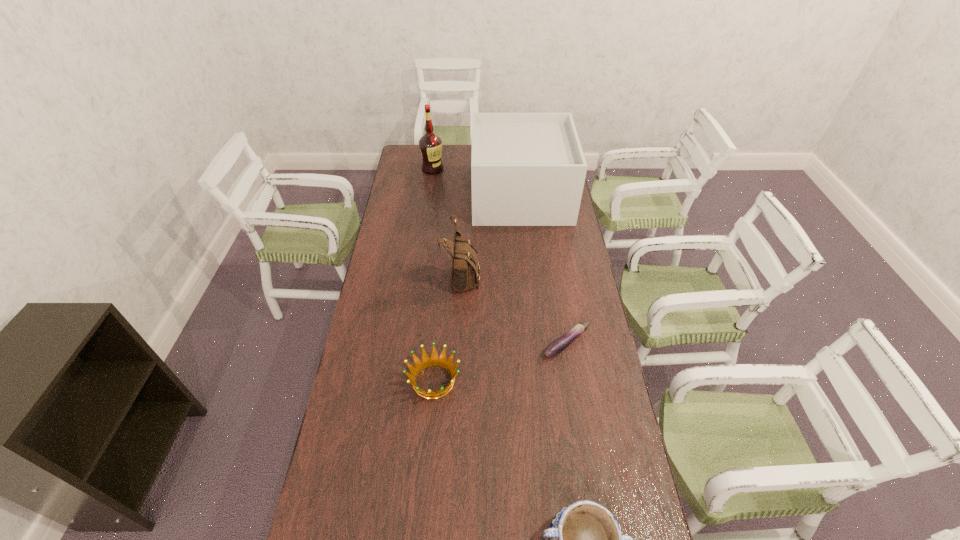
Identify the location of alcohol. (430, 144).

Image resolution: width=960 pixels, height=540 pixels. What are the coordinates of `box` in the screenshot? It's located at (527, 169).

You are a GUI agent. You are given a task and a screenshot of the screen. Output one action in this format:
    pyautogui.click(x=<x>, y=<y>)
    Task: Click on the fourth nearest object
    This screenshot has height=540, width=960.
    Given the screenshot: What is the action you would take?
    (464, 273)

I want to click on crown, so click(x=434, y=360).

Where is `eggplant`? The width and height of the screenshot is (960, 540). eggplant is located at coordinates (557, 346).

Where is `vacant region located on the label of the alcohol`? This screenshot has width=960, height=540. vacant region located on the label of the alcohol is located at coordinates (430, 190).

This screenshot has height=540, width=960. In order to click on vacant space located 0.100m on the side of the box with the window in this screenshot , I will do `click(452, 195)`.

The height and width of the screenshot is (540, 960). What are the coordinates of `vacant area located 0.120m on the side of the box with the window` in the screenshot? It's located at (448, 195).

Locate an element on the screen. vacant space located on the side of the box with the window is located at coordinates (448, 195).

The width and height of the screenshot is (960, 540). I want to click on free spot located on the front-facing side of the fourth nearest object, so click(570, 274).